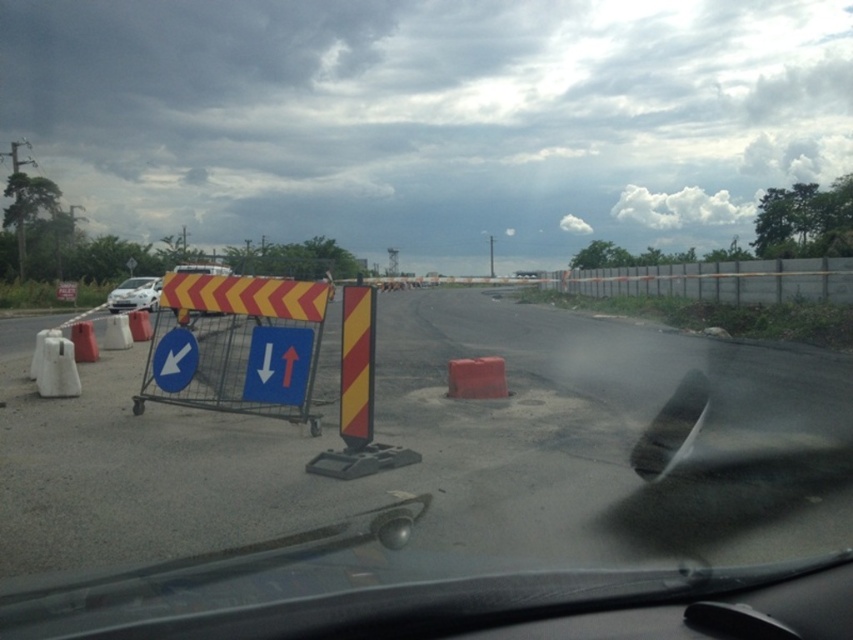
Is yellow/red striped shopping cart at left below white matte car at left?

Correct, yellow/red striped shopping cart at left is located below white matte car at left.

Can you confirm if yellow/red striped shopping cart at left is positioned to the right of white matte car at left?

Indeed, yellow/red striped shopping cart at left is positioned on the right side of white matte car at left.

Between point (183, 388) and point (120, 307), which one is positioned behind?

Positioned behind is point (120, 307).

This screenshot has height=640, width=853. Identify the location of yellow/red striped shopping cart at left. (236, 346).

Who is positioned more to the left, blue plastic arrow at left or white matte car at left?

white matte car at left is more to the left.

Is point (173, 384) more distant than point (138, 280)?

No, (173, 384) is closer to viewer.

Is point (194, 358) positioned behind point (138, 300)?

No, (194, 358) is in front of (138, 300).

Identify the location of blue plastic arrow at left. The width and height of the screenshot is (853, 640). (173, 358).

Is the position of blue plastic sign at center less distant than that of blue plastic arrow at left?

Yes, blue plastic sign at center is closer to the viewer.

Does blue plastic sign at center have a smaller size compared to blue plastic arrow at left?

No, blue plastic sign at center is not smaller than blue plastic arrow at left.

Identify the location of blue plastic sign at center. This screenshot has height=640, width=853. (277, 364).